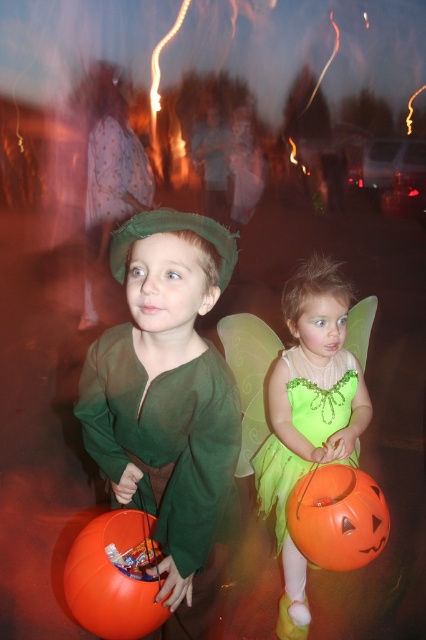
Question: Is the position of green matte costume at center more distant than that of orange matte pumpkin at lower left?

Choices:
 (A) no
 (B) yes

Answer: (A)

Question: Which of the following is the closest to the observer?

Choices:
 (A) green matte costume at center
 (B) lime green tulle dress at lower center
 (C) orange matte pumpkin at lower left
 (D) green tulle dress at lower right

Answer: (A)

Question: Can you confirm if green tulle dress at lower right is wider than orange matte pumpkin at lower center?

Choices:
 (A) yes
 (B) no

Answer: (A)

Question: Observing the image, what is the correct spatial positioning of green matte costume at center in reference to orange matte pumpkin at lower center?

Choices:
 (A) above
 (B) below

Answer: (A)

Question: Which of these objects is positioned closest to the orange matte pumpkin at lower center?

Choices:
 (A) green tulle dress at lower right
 (B) orange matte pumpkin at lower left
 (C) lime green tulle dress at lower center
 (D) green matte costume at center

Answer: (A)

Question: Which object is closer to the camera taking this photo?

Choices:
 (A) orange matte pumpkin at lower center
 (B) green matte costume at center
 (C) green tulle dress at lower right
 (D) orange matte pumpkin at lower left

Answer: (B)